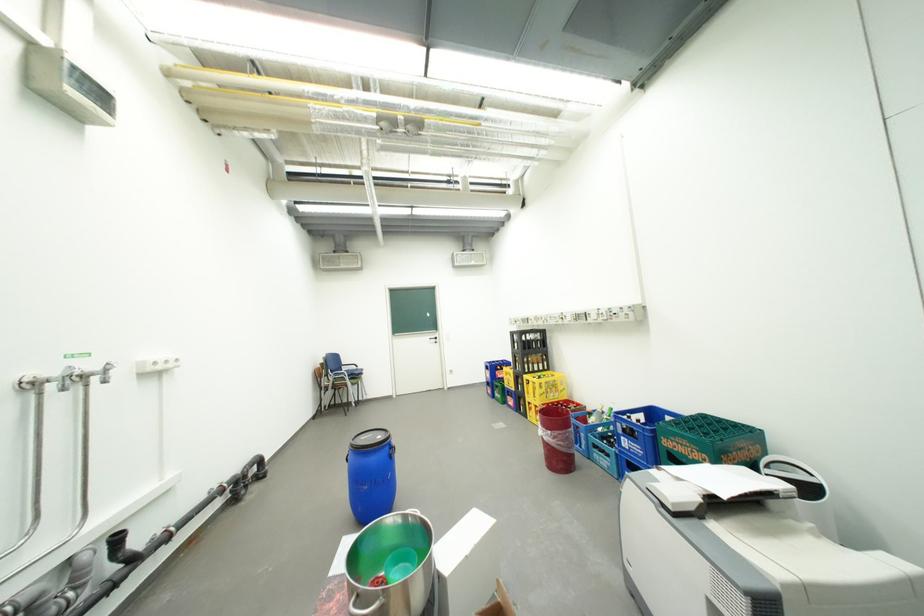
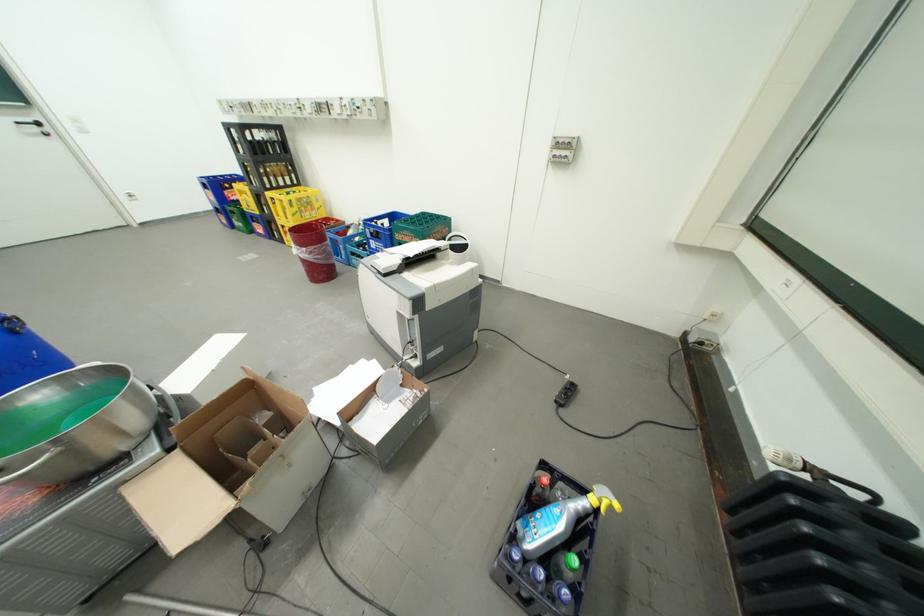
Locate, in the second image, the point that corresponds to point 429,515 in the first image.

(108, 365)